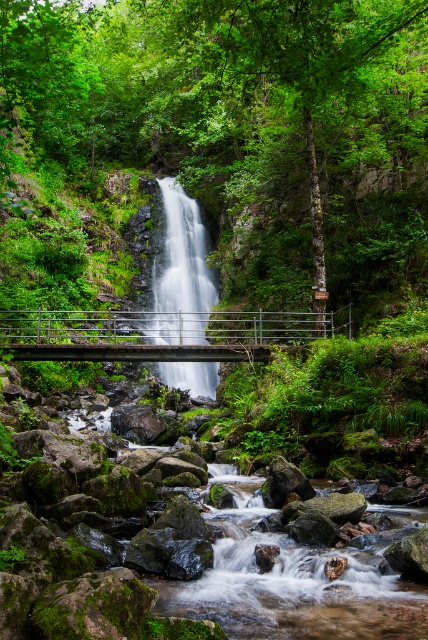
You are a hiker standing on the metal bridge and looking at the green leafy forest at center and the translucent glass waterfall at center. Which object is bigger in size?

The green leafy forest at center is larger in size compared to the translucent glass waterfall at center.

You are a hiker standing on the gray metallic bridge at center and want to take a photo of the green leafy forest at center. Which direction should you look to capture both the forest and the bridge in the same frame?

The green leafy forest at center is above the gray metallic bridge at center, so you should look upward to include both the forest and the bridge in your photo.

You are a landscape architect evaluating the scene. You need to determine if the gray metallic bridge at center can be fully seen without obstruction from the translucent glass waterfall at center. Based on their spatial relationship, what is your conclusion?

The gray metallic bridge at center occupies less space than the translucent glass waterfall at center, so it is likely partially or fully obscured by the waterfall, making it not fully visible.